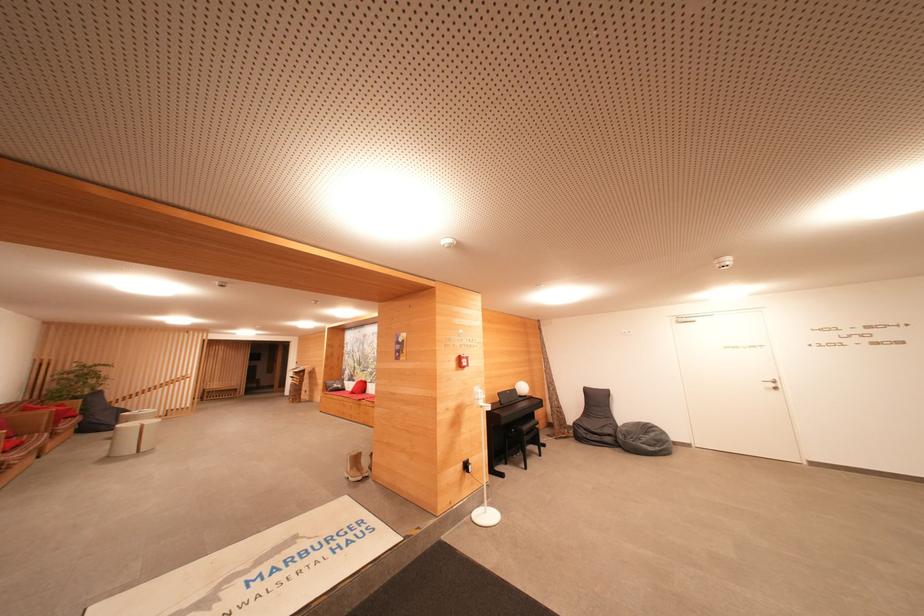
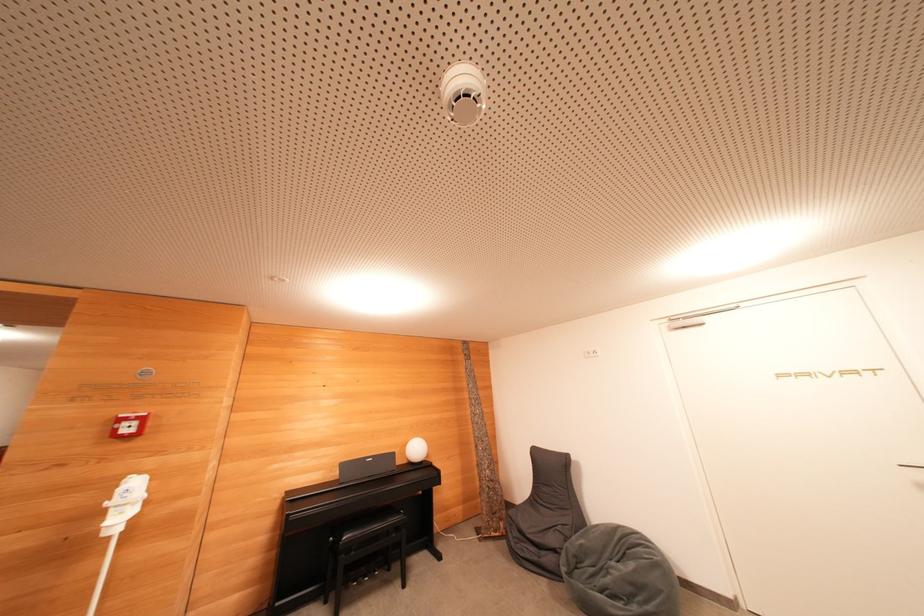
Locate, in the second image, the point that corresponds to (x=527, y=391) in the first image.

(419, 453)